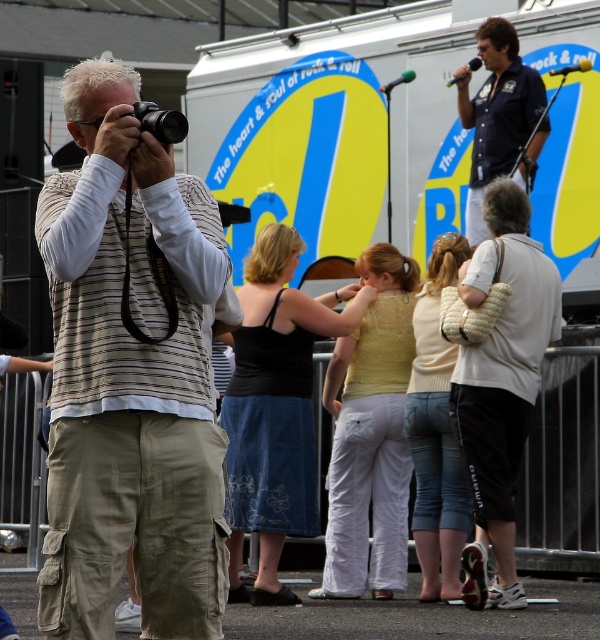
You are a photographer at the event and need to position your equipment. The dark blue shirt at upper right and the black plastic camera at left are both in your frame. Which object takes up more space horizontally?

The black plastic camera at left takes up more space horizontally since it has a greater width than the dark blue shirt at upper right.